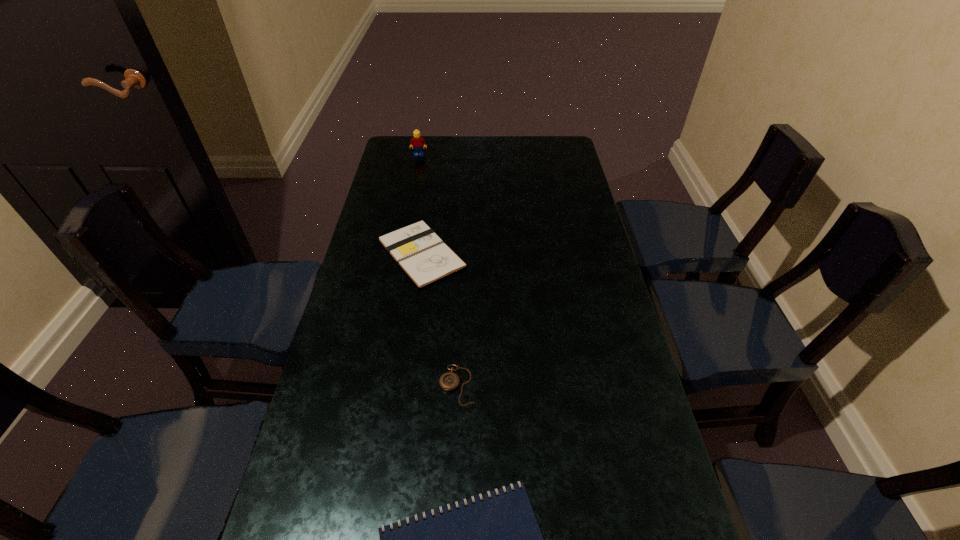
Locate an element on the screen. vacant space in between the third farthest object and the taller notepad is located at coordinates (439, 319).

I want to click on empty space between the taller notepad and the pocket watch, so click(439, 319).

Image resolution: width=960 pixels, height=540 pixels. In order to click on object that is the closest to the shorter notepad in this screenshot , I will do `click(449, 381)`.

Locate which object is the closest to the taller notepad. Please provide its 2D coordinates. Your answer should be formatted as a tuple, i.e. [(x, y)], where the tuple contains the x and y coordinates of a point satisfying the conditions above.

[(449, 381)]

You are a GUI agent. You are given a task and a screenshot of the screen. Output one action in this format:
    pyautogui.click(x=<x>, y=<y>)
    Task: Click on the vacant region that satisfies the following two spatial constraints: 1. on the front-facing side of the pocket watch; 2. on the right side of the farthest object
    
    Given the screenshot: What is the action you would take?
    pyautogui.click(x=375, y=385)

I want to click on free location that satisfies the following two spatial constraints: 1. on the front-facing side of the farthest object; 2. on the right side of the farther notepad, so click(x=400, y=254).